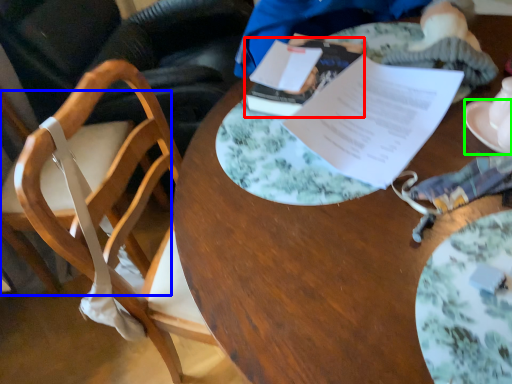
Question: Which object is the farthest from journal (highlighted by a red box)? Choose among these: chair (highlighted by a blue box) or saucer (highlighted by a green box).

Choices:
 (A) chair
 (B) saucer

Answer: (A)